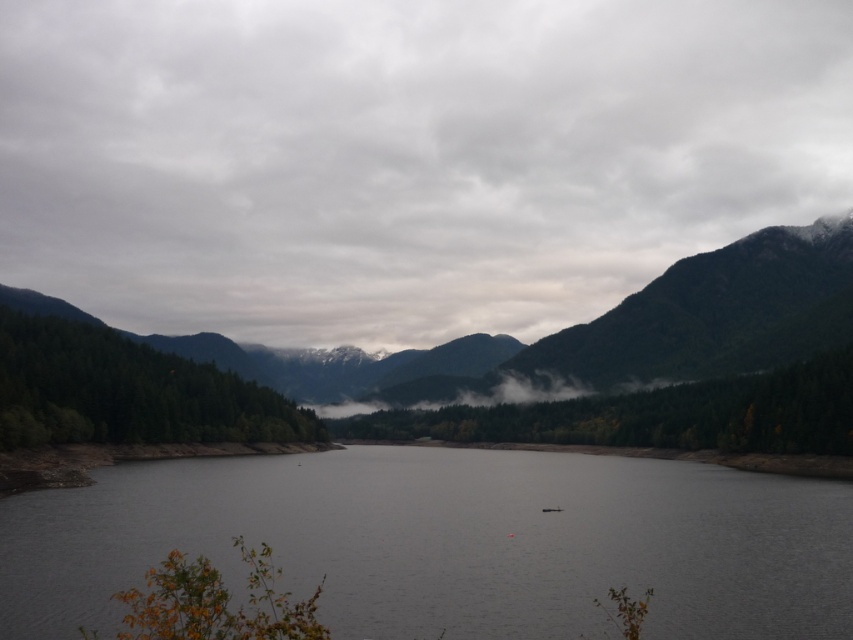
Question: Can you confirm if gray water at center is positioned to the right of green matte forest at center?

Choices:
 (A) no
 (B) yes

Answer: (A)

Question: Estimate the real-world distances between objects in this image. Which object is closer to the green matte forest at center?

Choices:
 (A) gray water at center
 (B) green matte forest at left

Answer: (A)

Question: Is the position of gray water at center more distant than that of green matte forest at left?

Choices:
 (A) yes
 (B) no

Answer: (B)

Question: Is cloudy sky at upper center thinner than green matte forest at left?

Choices:
 (A) yes
 (B) no

Answer: (B)

Question: Which of the following is the closest to the observer?

Choices:
 (A) (184, 416)
 (B) (724, 449)
 (C) (572, 292)
 (D) (398, 483)

Answer: (D)

Question: Which object is positioned closest to the green matte forest at center?

Choices:
 (A) gray water at center
 (B) green matte forest at left
 (C) cloudy sky at upper center

Answer: (A)